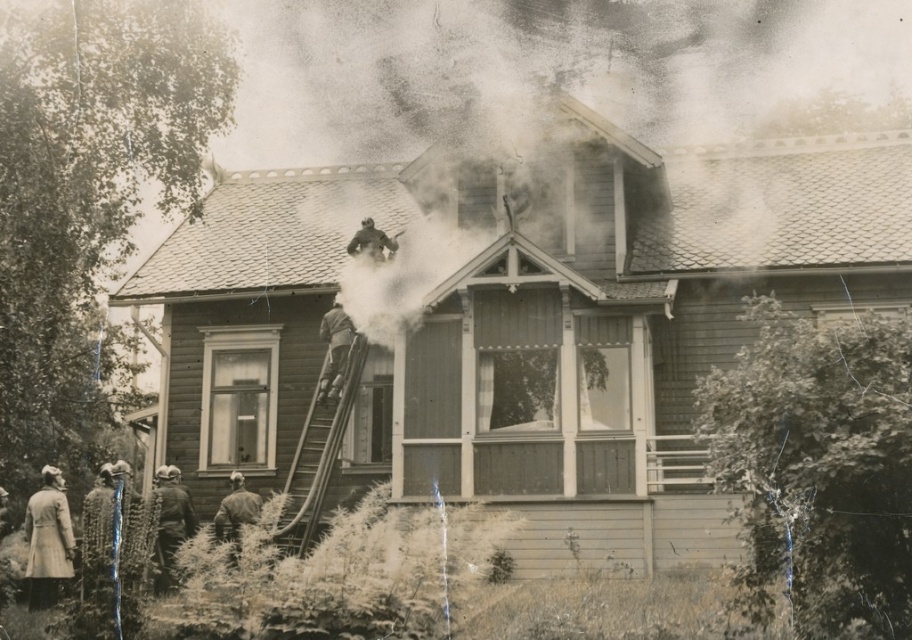
You are a firefighter arriving at the scene of a house fire. You see a dark brown leather jacket at lower left and a wooden ladder at upper center. Which object is closer to the ground?

The dark brown leather jacket at lower left is closer to the ground since it is positioned under the wooden ladder at upper center.

You are a firefighter trying to assess the situation. You see a dark brown leather jacket at lower left and a wooden ladder at upper center. Which object takes up more space in the image?

The dark brown leather jacket at lower left is bigger than the wooden ladder at upper center, so it takes up more space in the image.